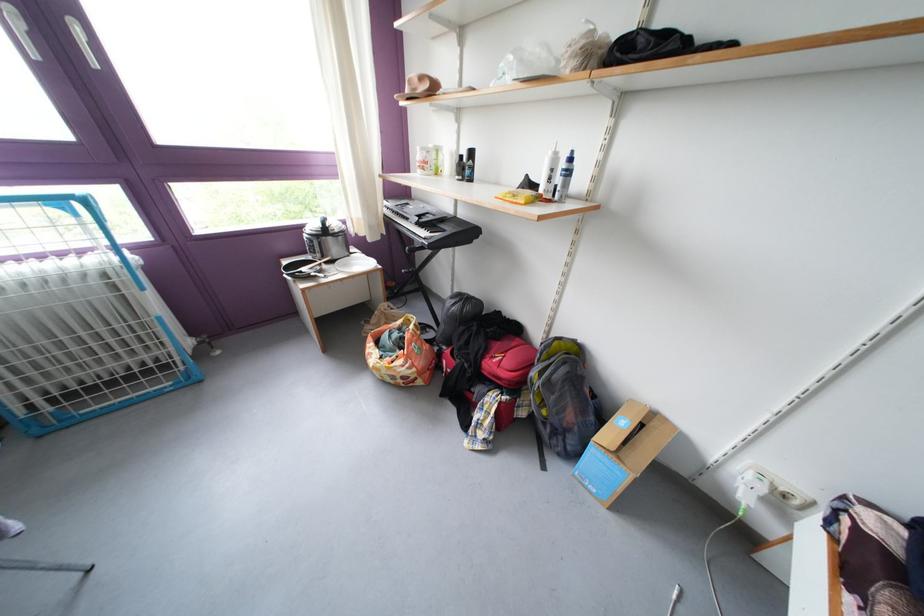
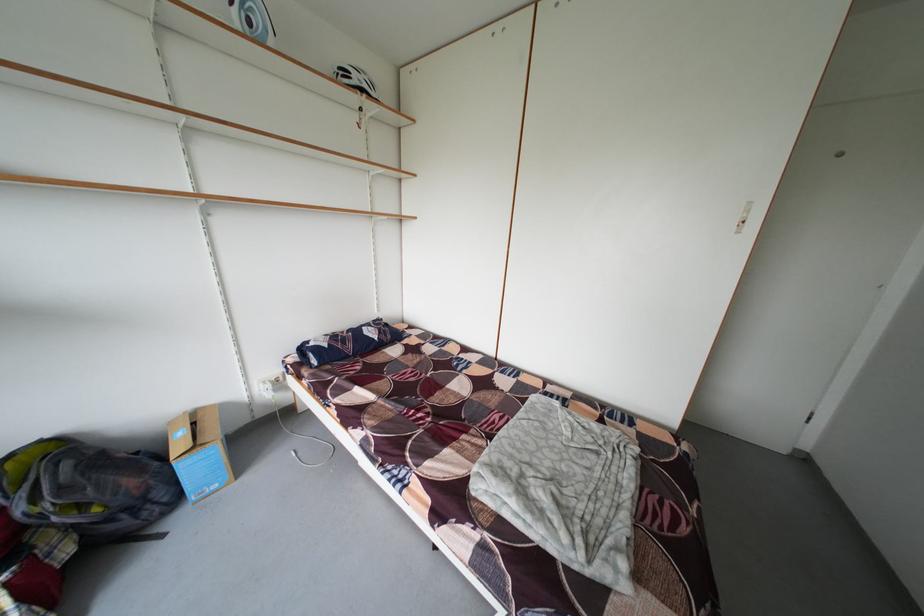
In the second image, find the point that corresponds to the point at 543,379 in the first image.

(31, 515)